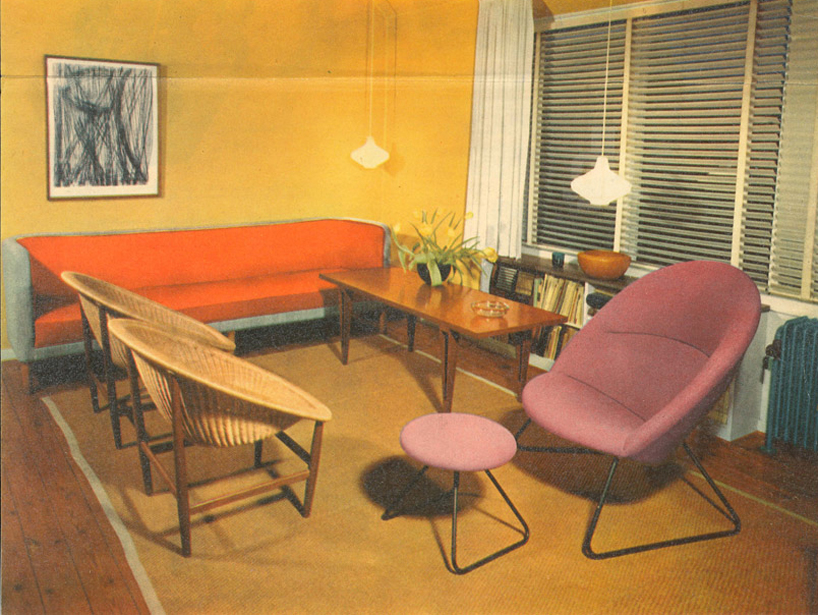
At what (x,y) coordinates should I click in order to perform the action: click on stool. Please return your answer as a coordinate pair (x, y). Looking at the image, I should click on (460, 435).